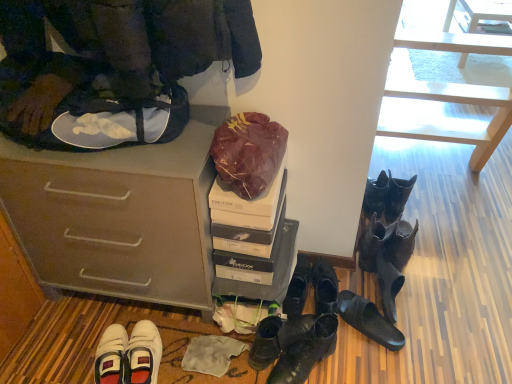
Find the location of a particular element. vacant region above black leather shoes at lower center, marked as the fifth footwear in a right-to-left arrangement (from a real-world perspective) is located at coordinates (326, 288).